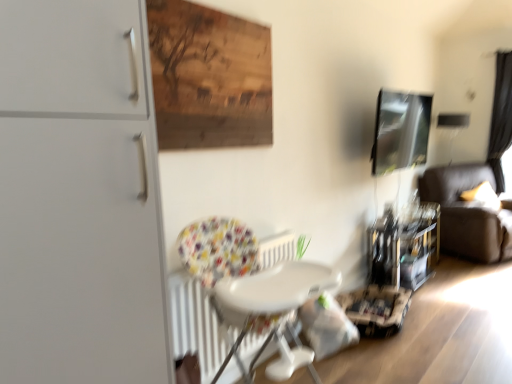
Where is `empty space that is ontop of wooden panel at upper center`? The image size is (512, 384). empty space that is ontop of wooden panel at upper center is located at coordinates (208, 7).